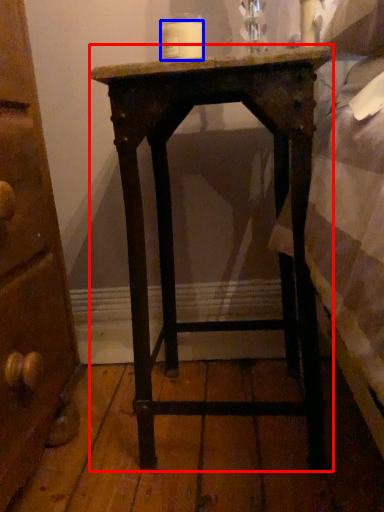
Question: Which point is closer to the camera, nightstand (highlighted by a red box) or candle (highlighted by a blue box)?

Choices:
 (A) nightstand
 (B) candle

Answer: (A)